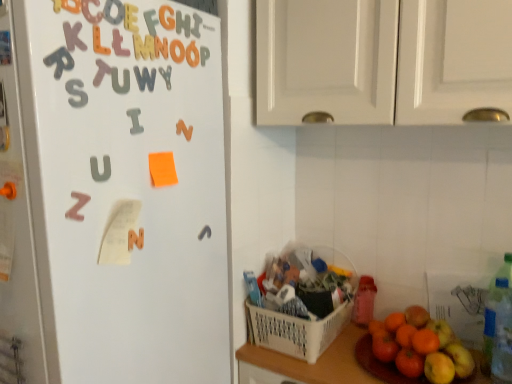
Identify the location of empty space that is ontop of white plastic basket at lower center (from a real-world perspective). tap(310, 296).